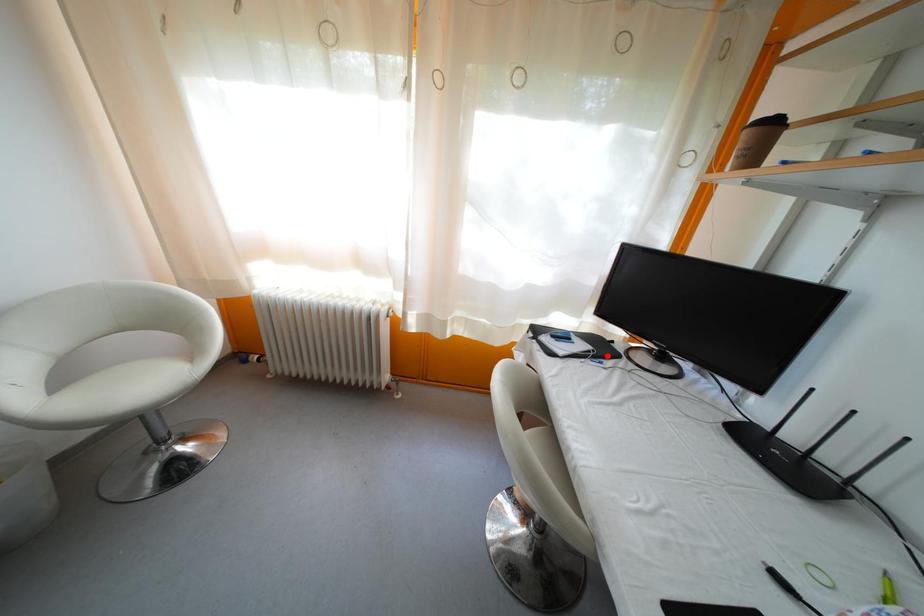
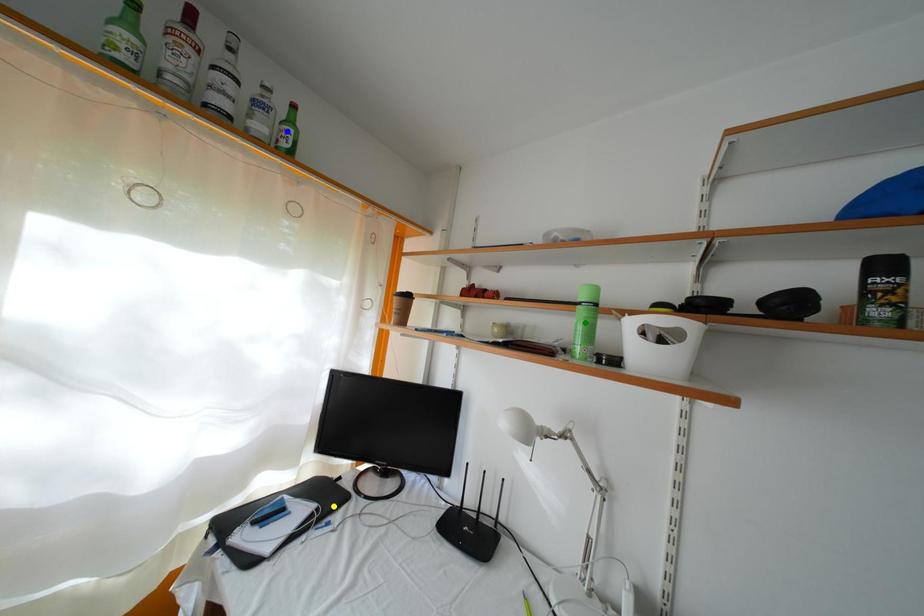
Question: I am providing you with two images of the same scene from different viewpoints. A red point is marked on the first image. You are given multiple points on the second image. Which spot in image 2 lines up with the point in image 1?

Choices:
 (A) yellow point
 (B) green point
 (C) blue point

Answer: (A)